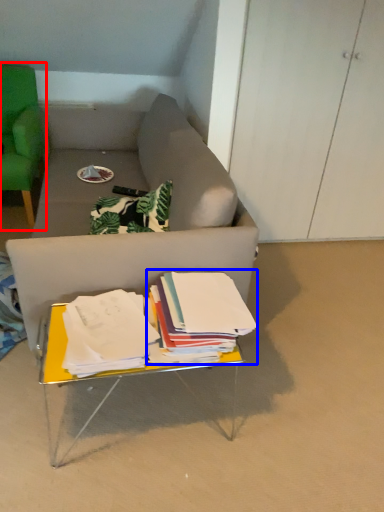
Question: Among these objects, which one is farthest to the camera, chair (highlighted by a red box) or paperback book (highlighted by a blue box)?

Choices:
 (A) chair
 (B) paperback book

Answer: (A)